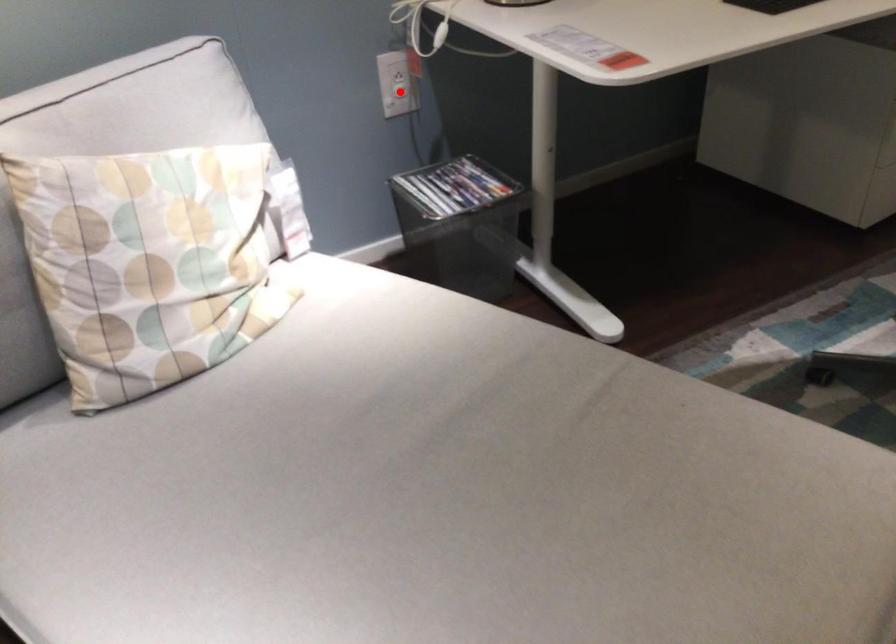
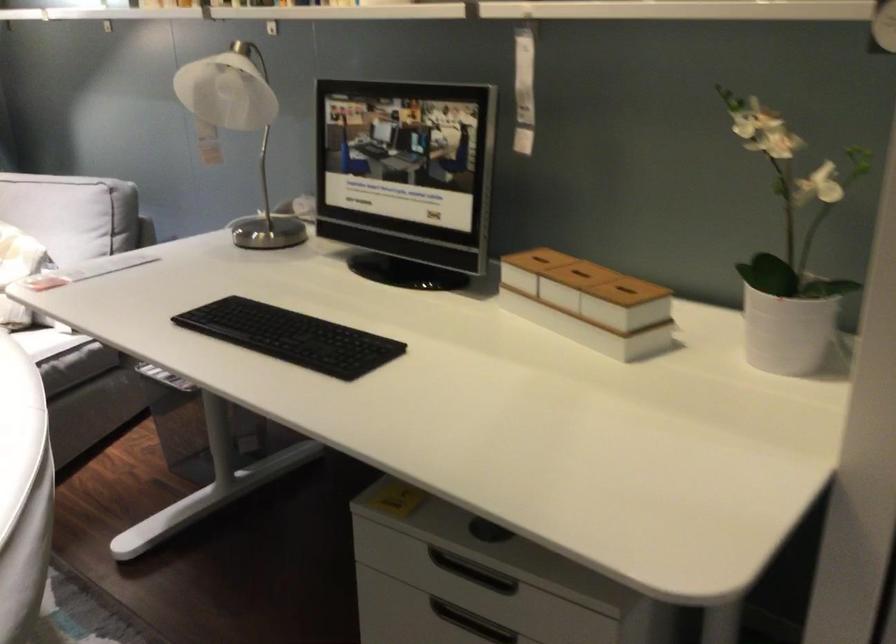
Question: I am providing you with two images of the same scene from different viewpoints. A red point is marked on the first image. Is the red point's position out of view in image 2?

Choices:
 (A) Yes
 (B) No

Answer: (A)